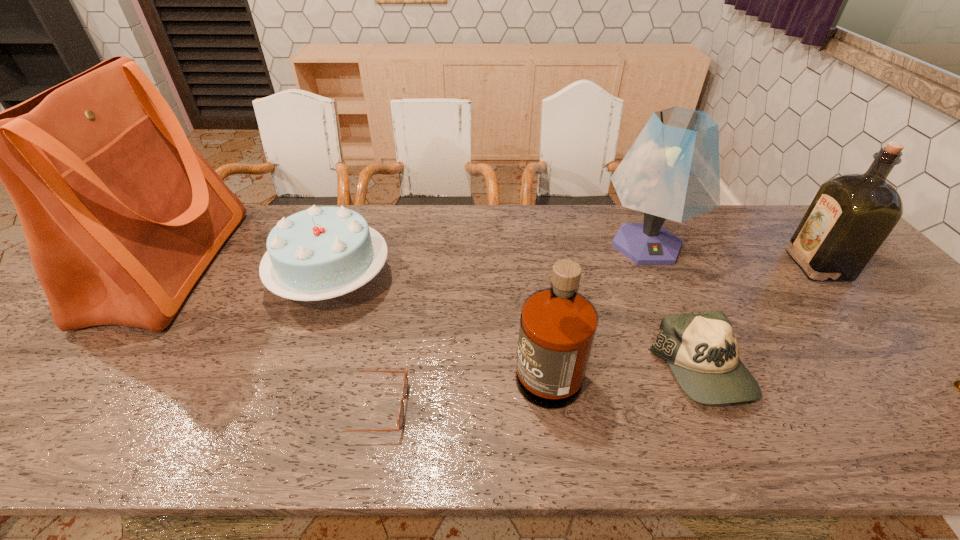
The height and width of the screenshot is (540, 960). I want to click on lampshade located at the far edge, so click(671, 171).

Find the location of `liquor that is at the far edge`. liquor that is at the far edge is located at coordinates pos(850,217).

I want to click on birthday cake that is at the far edge, so [320, 253].

I want to click on baseball cap present at the near edge, so click(x=700, y=348).

You are a GUI agent. You are given a task and a screenshot of the screen. Output one action in this format:
    pyautogui.click(x=<x>, y=<y>)
    Task: Click on the sunglasses that is at the near edge
    This screenshot has height=540, width=960.
    Given the screenshot: What is the action you would take?
    pyautogui.click(x=400, y=419)

Image resolution: width=960 pixels, height=540 pixels. Find the location of `object that is at the left edge`. object that is at the left edge is located at coordinates (121, 213).

Locate an element on the screen. The width and height of the screenshot is (960, 540). object at the right edge is located at coordinates coord(850,217).

I want to click on object positioned at the far left corner, so [121, 213].

Identify the location of object that is at the far right corner. This screenshot has height=540, width=960. (850, 217).

You are a GUI agent. You are given a task and a screenshot of the screen. Output one action in this format:
    pyautogui.click(x=<x>, y=<y>)
    Task: Click on the free region at the far edge of the desktop
    
    Given the screenshot: What is the action you would take?
    pyautogui.click(x=445, y=247)